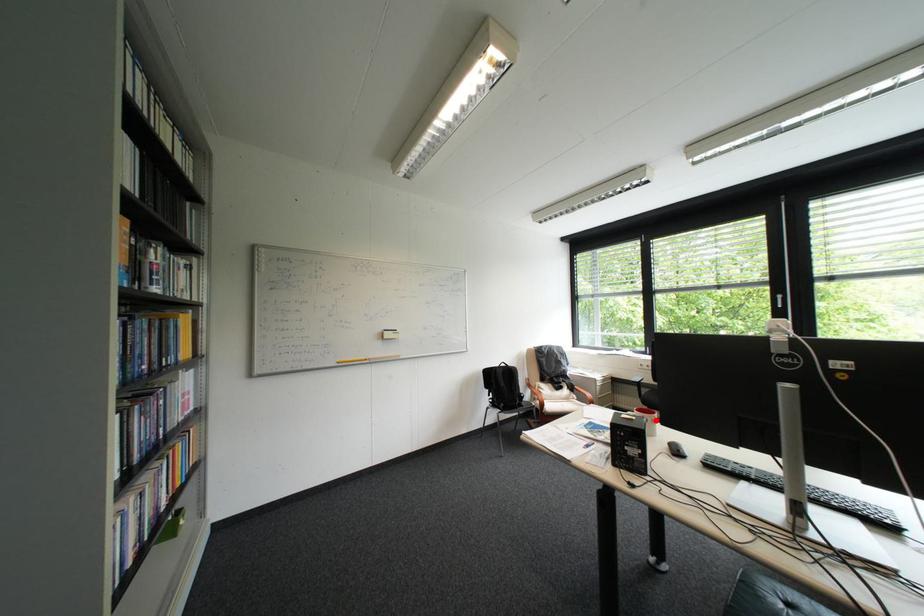
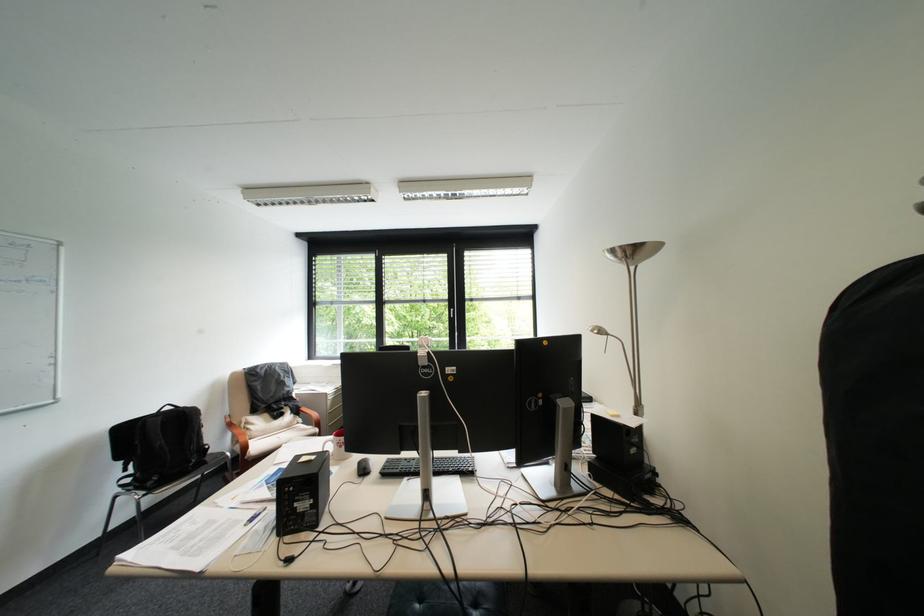
In the second image, find the point that corresponds to the highlighted location in the first image.

(337, 455)